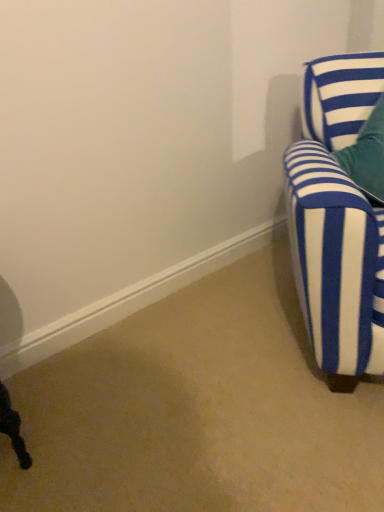
Question: Should I look upward or downward to see blue and white striped fabric chair at right?

Choices:
 (A) up
 (B) down

Answer: (A)